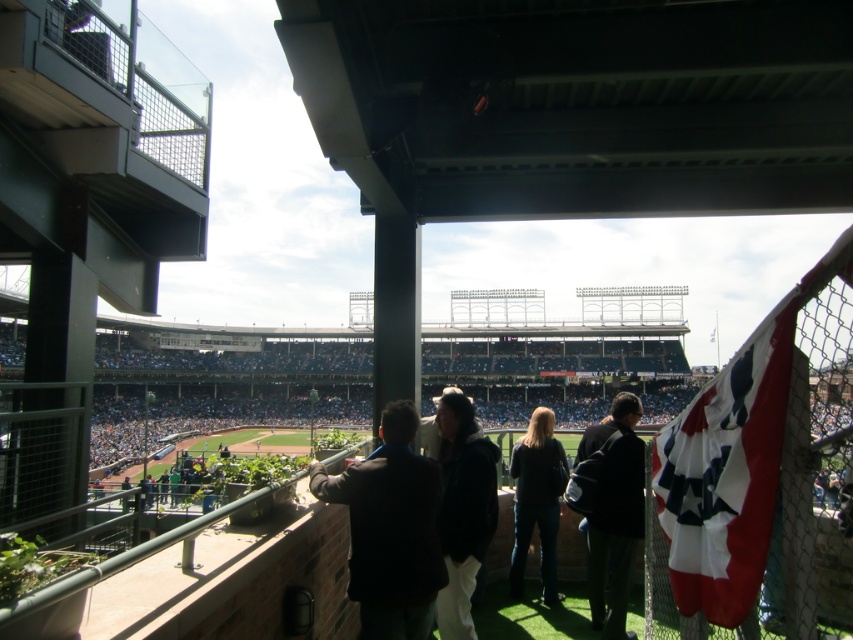
Question: Which point is farther to the camera?

Choices:
 (A) (421, 570)
 (B) (456, 467)
 (C) (523, 500)

Answer: (C)

Question: Can you confirm if dark gray jacket at center is positioned to the right of dark blue jeans at center?

Choices:
 (A) no
 (B) yes

Answer: (A)

Question: Is red and white fabric flag at right to the right of dark brown leather jacket at center from the viewer's perspective?

Choices:
 (A) yes
 (B) no

Answer: (A)

Question: Which is nearer to the dark brown leather jacket at center?

Choices:
 (A) dark blue jacket at lower right
 (B) red and white fabric flag at right
 (C) dark gray jacket at center

Answer: (C)

Question: Does dark brown leather jacket at center have a larger size compared to dark blue jacket at lower right?

Choices:
 (A) no
 (B) yes

Answer: (A)

Question: Which point is closer to the camera?

Choices:
 (A) (698, 396)
 (B) (621, 474)
 (C) (534, 461)

Answer: (A)